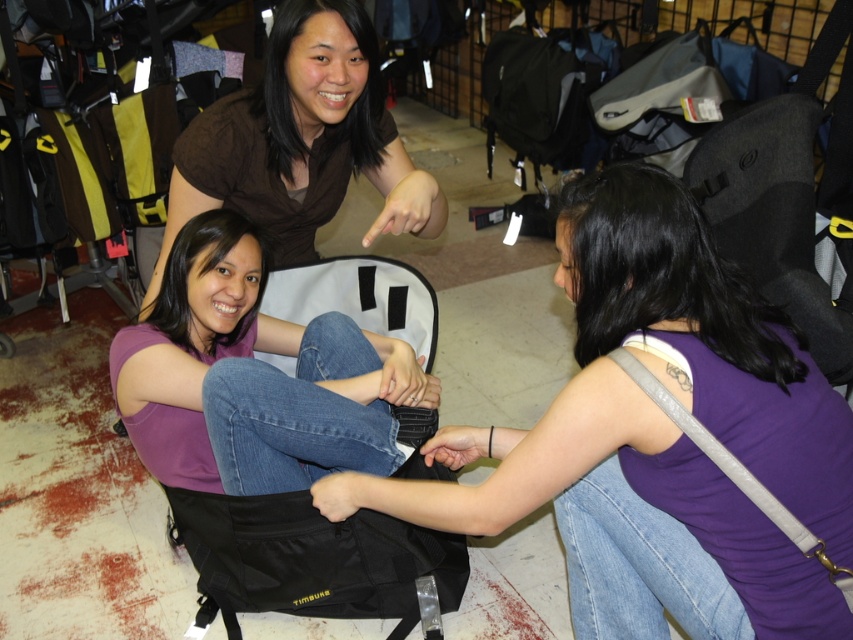
Question: Among these points, which one is farthest from the camera?

Choices:
 (A) (660, 552)
 (B) (137, 397)

Answer: (B)

Question: Does purple matte tank top at center have a smaller size compared to matte brown shirt at upper center?

Choices:
 (A) yes
 (B) no

Answer: (B)

Question: Is the position of matte brown shirt at upper center more distant than that of purple matte shirt at center?

Choices:
 (A) yes
 (B) no

Answer: (A)

Question: Does purple matte tank top at center appear on the right side of purple matte shirt at center?

Choices:
 (A) yes
 (B) no

Answer: (A)

Question: Which point is farther from the camera taking this photo?

Choices:
 (A) (294, 168)
 (B) (625, 256)
 (C) (303, 364)

Answer: (A)

Question: Estimate the real-world distances between objects in this image. Which object is farther from the purple matte shirt at center?

Choices:
 (A) purple matte tank top at center
 (B) matte brown shirt at upper center

Answer: (A)